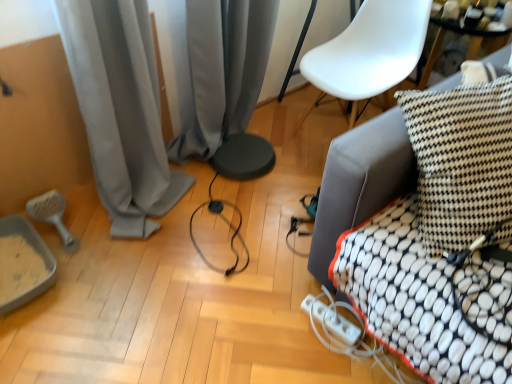
I want to click on blank space to the left of white plastic extension cord at lower center, so click(x=282, y=324).